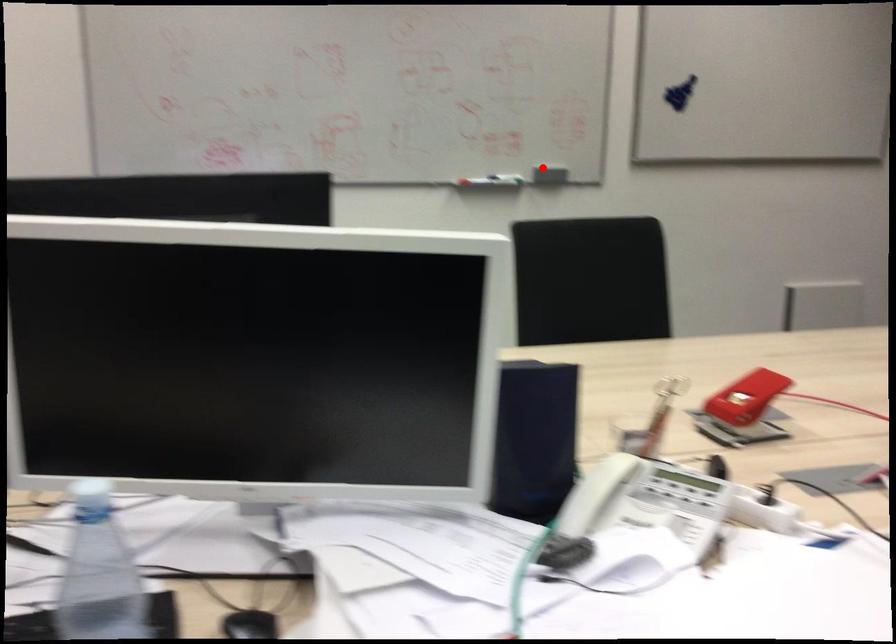
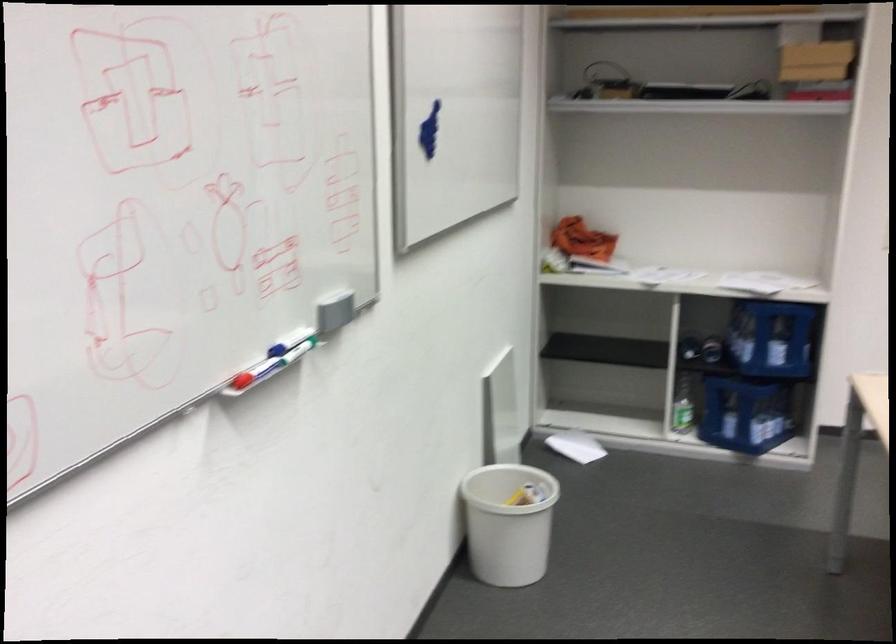
Question: I am providing you with two images of the same scene from different viewpoints. Image1 has a red point marked. In image2, the corresponding 3D location appears at what relative position? Reply with the corresponding letter.

Choices:
 (A) Closer
 (B) Farther

Answer: (A)